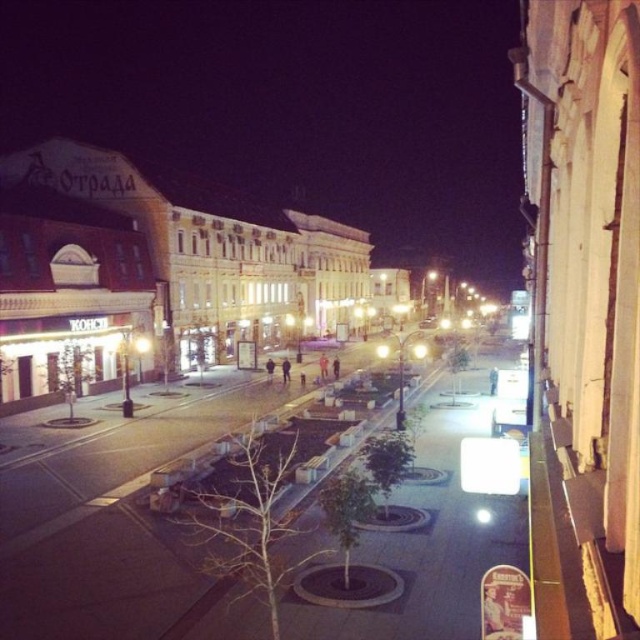
Question: Is smooth concrete benches at center above white painted building at left?

Choices:
 (A) yes
 (B) no

Answer: (B)

Question: Does smooth concrete benches at center have a smaller size compared to white painted building at left?

Choices:
 (A) no
 (B) yes

Answer: (B)

Question: Which of the following is the closest to the observer?

Choices:
 (A) smooth concrete benches at center
 (B) white painted building at left

Answer: (A)

Question: Does smooth concrete benches at center have a larger size compared to white painted building at left?

Choices:
 (A) yes
 (B) no

Answer: (B)